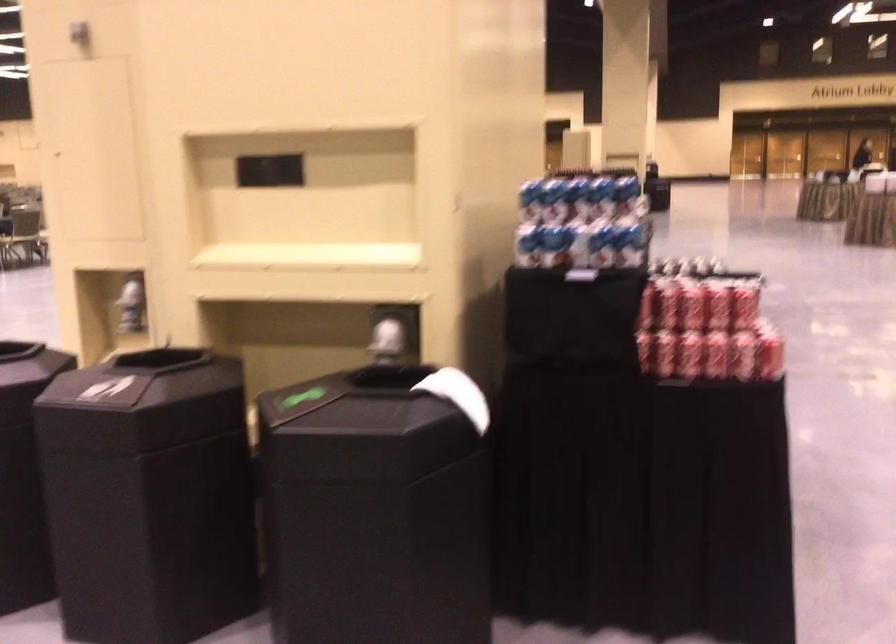
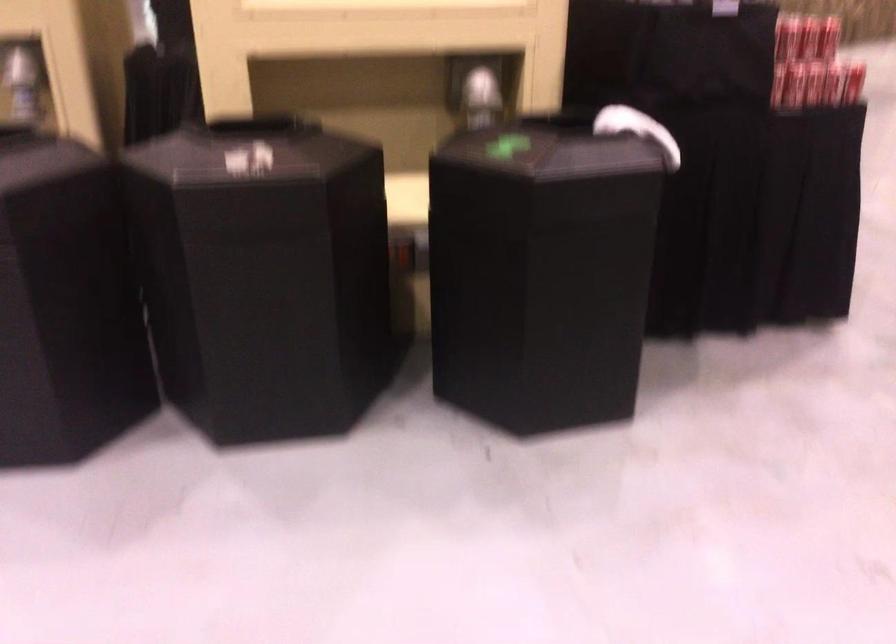
Locate, in the second image, the point that corresponds to pixel 440 393 in the first image.

(636, 129)